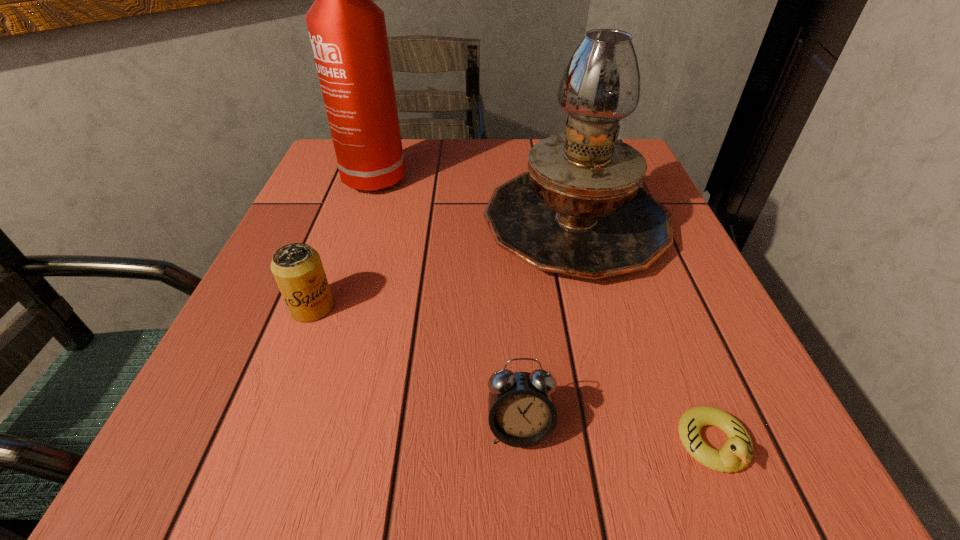
Image resolution: width=960 pixels, height=540 pixels. In order to click on alarm clock present at the near edge in this screenshot , I will do `click(521, 412)`.

This screenshot has height=540, width=960. I want to click on duckling present at the near edge, so click(737, 452).

You are a GUI agent. You are given a task and a screenshot of the screen. Output one action in this format:
    pyautogui.click(x=<x>, y=<y>)
    Task: Click on the fire extinguisher that is positioned at the left edge
    
    Given the screenshot: What is the action you would take?
    pyautogui.click(x=347, y=30)

Locate an element on the screen. The width and height of the screenshot is (960, 540). beer can that is at the left edge is located at coordinates (297, 268).

This screenshot has width=960, height=540. What are the coordinates of `oil lamp at the right edge` in the screenshot? It's located at (580, 210).

You are a GUI agent. You are given a task and a screenshot of the screen. Output one action in this format:
    pyautogui.click(x=<x>, y=<y>)
    Task: Click on the duckling located at the right edge
    The image size is (960, 540).
    Given the screenshot: What is the action you would take?
    pyautogui.click(x=737, y=452)

Where is `object at the far left corner`? object at the far left corner is located at coordinates (347, 30).

In order to click on object positioned at the far right corner in this screenshot , I will do `click(580, 210)`.

This screenshot has width=960, height=540. In order to click on object that is at the near right corner in this screenshot , I will do `click(737, 452)`.

This screenshot has width=960, height=540. I want to click on vacant space at the far edge of the desktop, so click(x=423, y=146).